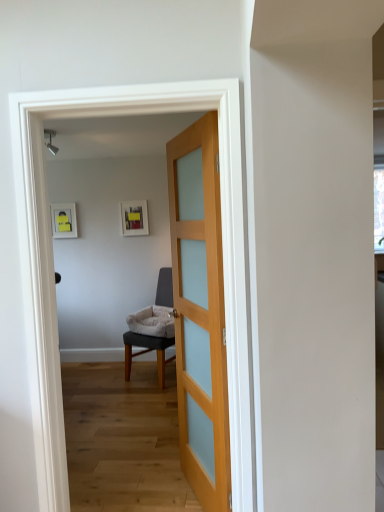
Identify the location of light wood/transparent glass door at center. The image size is (384, 512). (200, 311).

What do you see at coordinates (200, 311) in the screenshot?
I see `light wood/transparent glass door at center` at bounding box center [200, 311].

Image resolution: width=384 pixels, height=512 pixels. What do you see at coordinates (147, 352) in the screenshot?
I see `light gray fabric chair at center` at bounding box center [147, 352].

At what (x,y) coordinates should I click in order to perform the action: click on light gray fabric chair at center. Please return your answer as a coordinate pair (x, y). This screenshot has height=512, width=384. Looking at the image, I should click on (147, 352).

Find the location of `light wood/transparent glass door at center`. light wood/transparent glass door at center is located at coordinates (200, 311).

Does light wood/transparent glass door at center appear on the right side of light gray fabric chair at center?

Yes, light wood/transparent glass door at center is to the right of light gray fabric chair at center.

Is light wood/transparent glass door at center further to camera compared to light gray fabric chair at center?

No.

Does point (204, 186) appear closer or farther from the camera than point (126, 356)?

Clearly, point (204, 186) is closer to the camera than point (126, 356).

From the image's perspective, is light wood/transparent glass door at center over light gray fabric chair at center?

Indeed, from the image's perspective, light wood/transparent glass door at center is shown above light gray fabric chair at center.

From a real-world perspective, which object stands above the other?

In real-world perspective, light wood/transparent glass door at center is above.

Which of these two, light wood/transparent glass door at center or light gray fabric chair at center, is thinner?

Thinner between the two is light wood/transparent glass door at center.

Is light wood/transparent glass door at center taller or shorter than light gray fabric chair at center?

light wood/transparent glass door at center is taller than light gray fabric chair at center.

Is light wood/transparent glass door at center bigger or smaller than light gray fabric chair at center?

Considering their sizes, light wood/transparent glass door at center takes up less space than light gray fabric chair at center.

Is light wood/transparent glass door at center not inside light gray fabric chair at center?

light wood/transparent glass door at center is positioned outside light gray fabric chair at center.

Is light wood/transparent glass door at center far from light gray fabric chair at center?

Yes, light wood/transparent glass door at center and light gray fabric chair at center are quite far apart.

Is light wood/transparent glass door at center oriented away from light gray fabric chair at center?

light wood/transparent glass door at center does not have its back to light gray fabric chair at center.

How many degrees apart are the facing directions of light wood/transparent glass door at center and light gray fabric chair at center?

light wood/transparent glass door at center and light gray fabric chair at center are facing 39.6 degrees away from each other.

The width and height of the screenshot is (384, 512). In order to click on chair located underneath the light wood/transparent glass door at center (from a real-world perspective) in this screenshot , I will do `click(147, 352)`.

Between light gray fabric chair at center and light wood/transparent glass door at center, which one appears on the right side from the viewer's perspective?

light wood/transparent glass door at center is more to the right.

Considering the positions of objects light gray fabric chair at center and light wood/transparent glass door at center in the image provided, who is in front, light gray fabric chair at center or light wood/transparent glass door at center?

light wood/transparent glass door at center is closer to the camera.

Is point (168, 300) closer or farther from the camera than point (192, 201)?

Clearly, point (168, 300) is more distant from the camera than point (192, 201).

From the image's perspective, relative to light wood/transparent glass door at center, is light gray fabric chair at center above or below?

From the image's perspective, light gray fabric chair at center appears below light wood/transparent glass door at center.

From a real-world perspective, which is physically below, light gray fabric chair at center or light wood/transparent glass door at center?

From a 3D spatial view, light gray fabric chair at center is below.

Is light gray fabric chair at center wider than light wood/transparent glass door at center?

Yes.

Which of these two, light gray fabric chair at center or light wood/transparent glass door at center, stands shorter?

Standing shorter between the two is light gray fabric chair at center.

Between light gray fabric chair at center and light wood/transparent glass door at center, which one has smaller size?

light wood/transparent glass door at center.

Choose the correct answer: Is light gray fabric chair at center inside light wood/transparent glass door at center or outside it?

light gray fabric chair at center is outside light wood/transparent glass door at center.

Is light gray fabric chair at center far from light wood/transparent glass door at center?

Indeed, light gray fabric chair at center is not near light wood/transparent glass door at center.

Could you tell me if light gray fabric chair at center is facing light wood/transparent glass door at center?

No.

How much distance is there between light gray fabric chair at center and light wood/transparent glass door at center?

Answer: They are 1.86 meters apart.

Identify the location of chair lying on the left of light wood/transparent glass door at center. (147, 352).

Find the location of a particular element. chair that appears below the light wood/transparent glass door at center (from the image's perspective) is located at coordinates (147, 352).

Locate an element on the screen. The height and width of the screenshot is (512, 384). door on the right side of light gray fabric chair at center is located at coordinates (200, 311).